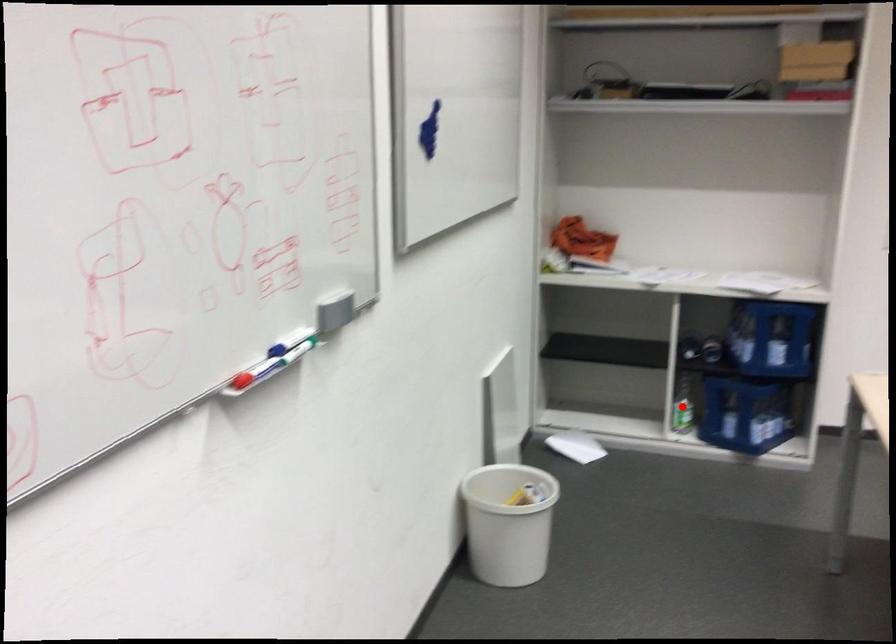
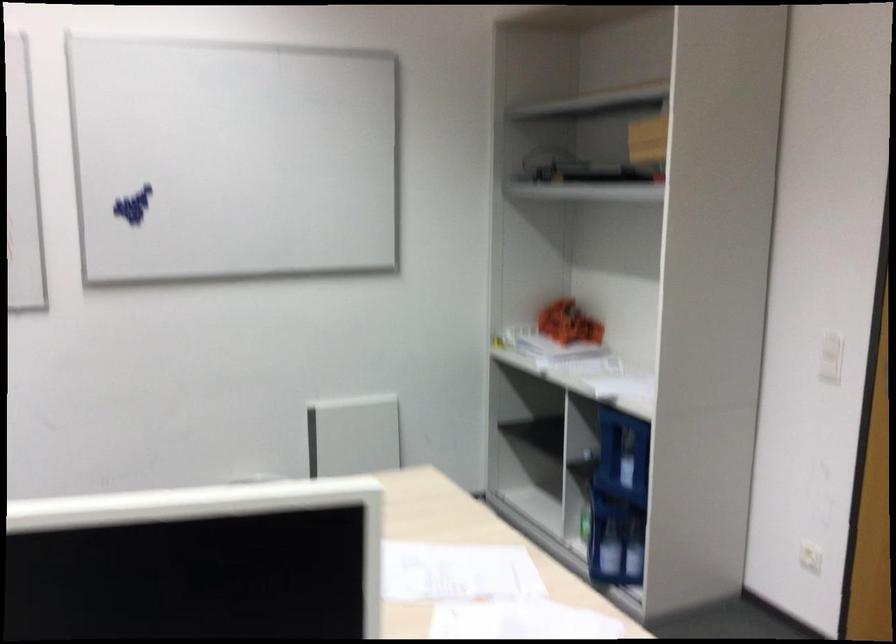
Question: I am providing you with two images of the same scene from different viewpoints. A red point is marked on the first image. Is the red point's position out of view in image 2?

Choices:
 (A) Yes
 (B) No

Answer: (A)